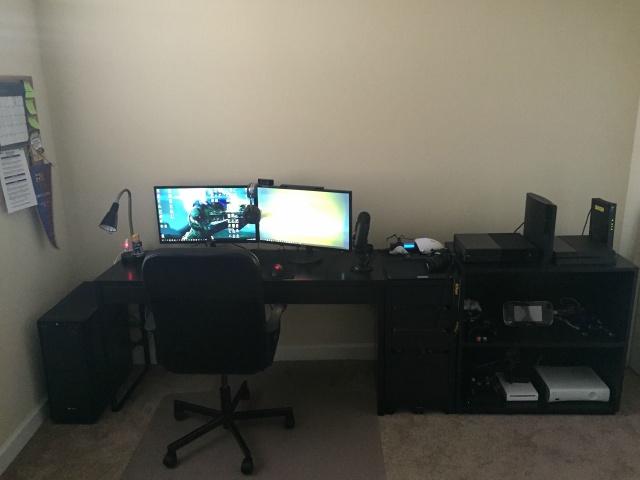
Locate an element on the screen. Image resolution: width=640 pixels, height=480 pixels. bulletin board is located at coordinates (4, 89).